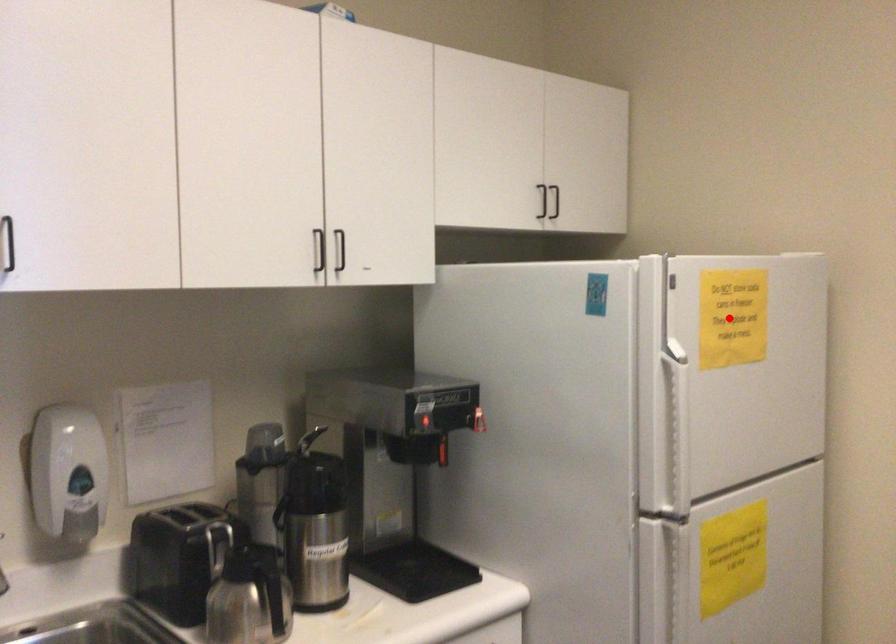
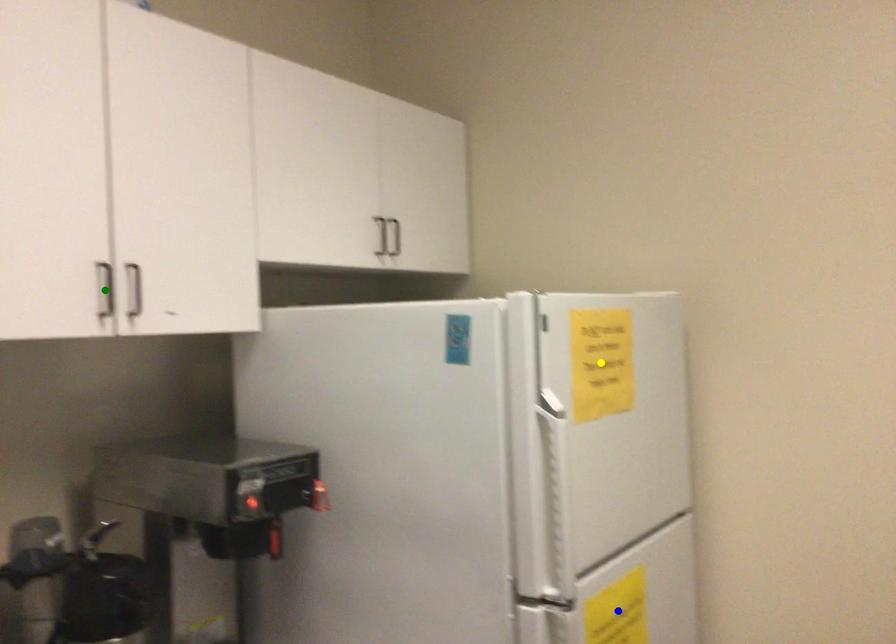
Question: I am providing you with two images of the same scene from different viewpoints. A red point is marked on the first image. You are given multiple points on the second image. Can you choose the point in image 2 that corresponds to the point in image 1?

Choices:
 (A) yellow point
 (B) blue point
 (C) green point

Answer: (A)